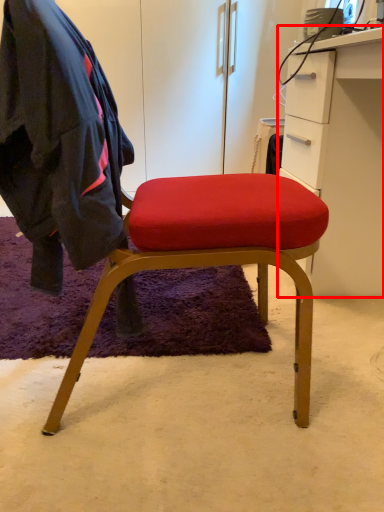
Question: From the image, what is the correct spatial relationship of cabinetry (annotated by the red box) in relation to clothing?

Choices:
 (A) left
 (B) right

Answer: (B)